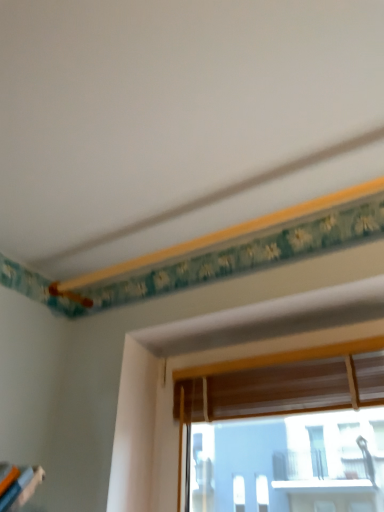
What do you see at coordinates (270, 377) in the screenshot? Image resolution: width=384 pixels, height=512 pixels. I see `wooden blinds at center` at bounding box center [270, 377].

In order to face wooden blinds at center, should I rotate leftwards or rightwards?

Turn right approximately 10.218 degrees to face it.

Where is `wooden blinds at center`? Image resolution: width=384 pixels, height=512 pixels. wooden blinds at center is located at coordinates (270, 377).

Locate an element on the screen. The width and height of the screenshot is (384, 512). wooden blinds at center is located at coordinates (270, 377).